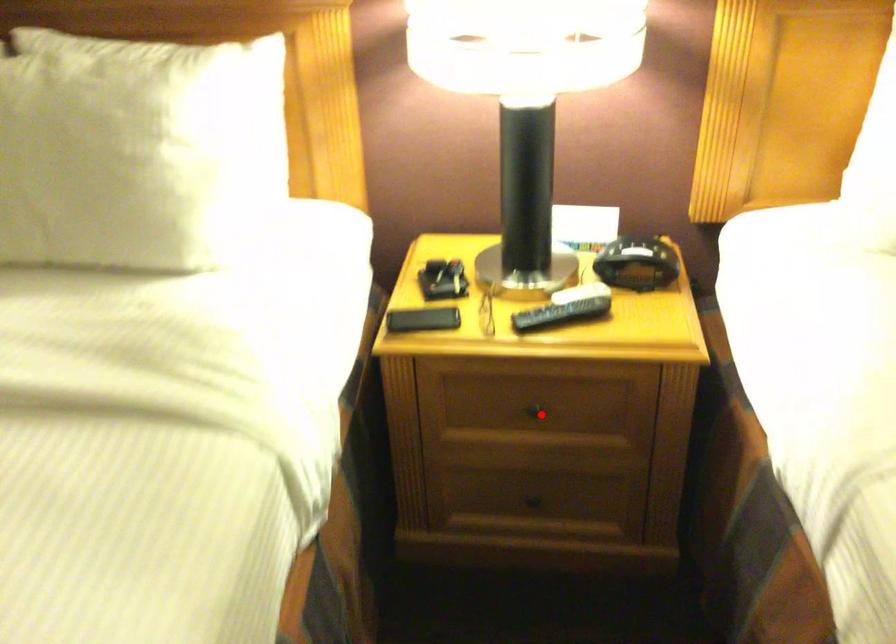
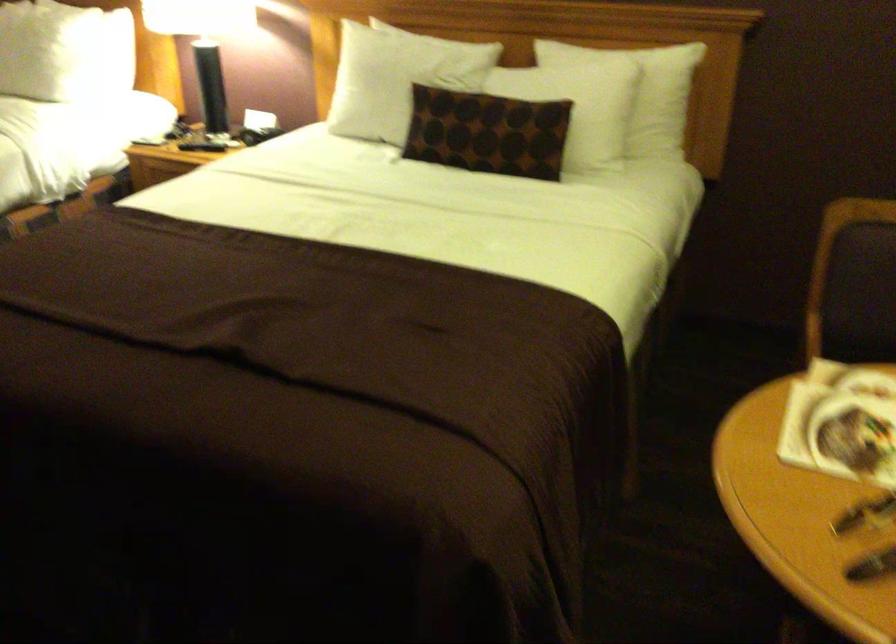
Question: I am providing you with two images of the same scene from different viewpoints. A red point is marked on the first image. Can you still see the location of the red point in image 2?

Choices:
 (A) Yes
 (B) No

Answer: (B)